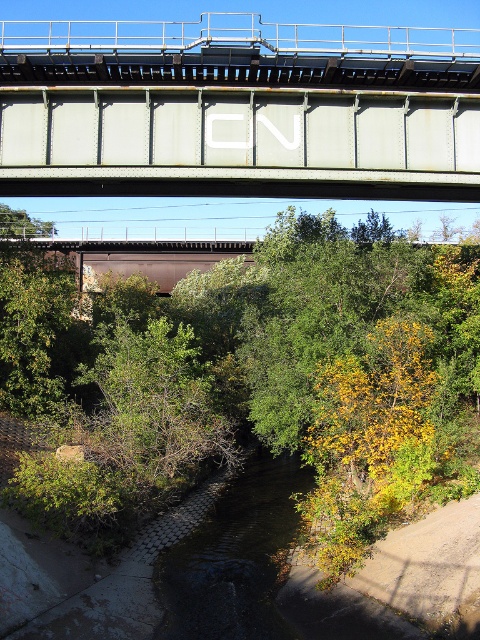
Can you confirm if green leafy tree at center is smaller than rusty metal bridge at upper center?

Yes, green leafy tree at center is smaller than rusty metal bridge at upper center.

Is green leafy tree at center above rusty metal bridge at upper center?

No, green leafy tree at center is not above rusty metal bridge at upper center.

Locate an element on the screen. This screenshot has height=640, width=480. green leafy tree at center is located at coordinates (255, 378).